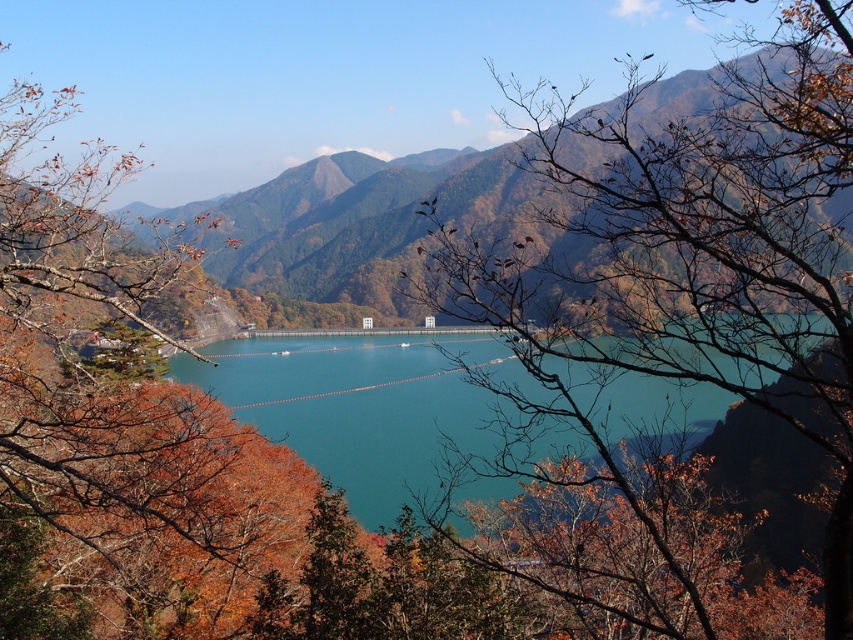
Can you confirm if brown leafy branches at center is taller than brown leafy branches at left?

Indeed, brown leafy branches at center has a greater height compared to brown leafy branches at left.

Which is behind, point (799, 340) or point (16, 211)?

Positioned behind is point (16, 211).

This screenshot has width=853, height=640. I want to click on brown leafy branches at center, so click(697, 259).

Can you confirm if brown leafy branches at left is smaller than green grassy mountain at center?

Correct, brown leafy branches at left occupies less space than green grassy mountain at center.

Can you confirm if brown leafy branches at left is taller than green grassy mountain at center?

No, brown leafy branches at left is not taller than green grassy mountain at center.

Is point (56, 156) less distant than point (495, 214)?

Yes.

At what (x,y) coordinates should I click in order to perform the action: click on brown leafy branches at left. Please return your answer as a coordinate pair (x, y). Looking at the image, I should click on (96, 403).

Is brown leafy branches at center positioned before teal glossy water at center?

Yes, it is in front of teal glossy water at center.

Is point (741, 330) more distant than point (757, 449)?

No, (741, 330) is closer to viewer.

Is point (833, 310) positioned behind point (815, 468)?

No, (833, 310) is closer to viewer.

Image resolution: width=853 pixels, height=640 pixels. Find the location of `brown leafy branches at center`. brown leafy branches at center is located at coordinates (697, 259).